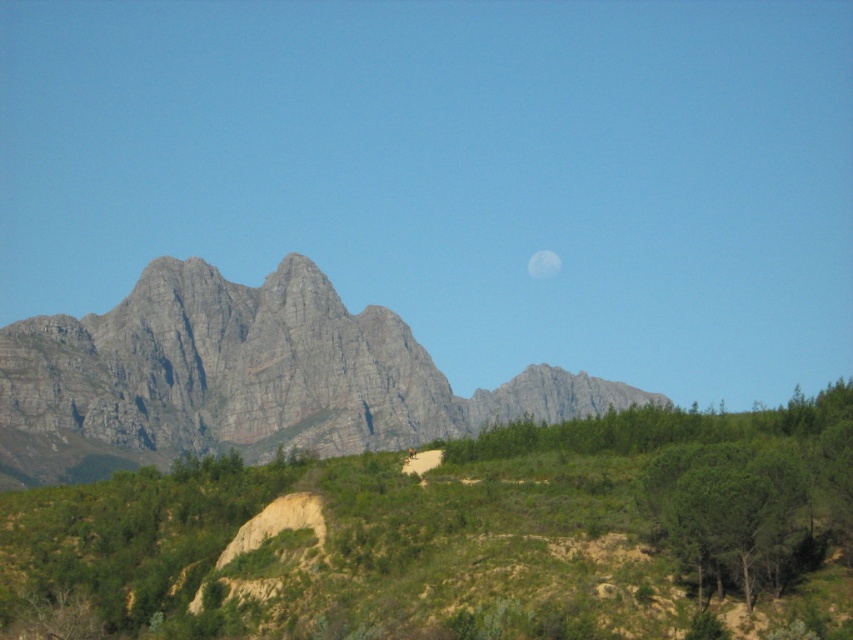
Question: Is gray rock mountain at upper left smaller than white matte moon at upper center?

Choices:
 (A) no
 (B) yes

Answer: (A)

Question: Which point is farther to the camera?

Choices:
 (A) (273, 330)
 (B) (543, 252)

Answer: (B)

Question: Estimate the real-world distances between objects in this image. Which object is farther from the gray rock mountain at upper left?

Choices:
 (A) white matte moon at upper center
 (B) green leafy tree at lower right

Answer: (B)

Question: Is gray rock mountain at upper left wider than white matte moon at upper center?

Choices:
 (A) no
 (B) yes

Answer: (B)

Question: Can you confirm if gray rock mountain at upper left is positioned to the left of white matte moon at upper center?

Choices:
 (A) no
 (B) yes

Answer: (B)

Question: Which point is farther from the camera taking this photo?

Choices:
 (A) (666, 506)
 (B) (335, 435)

Answer: (B)